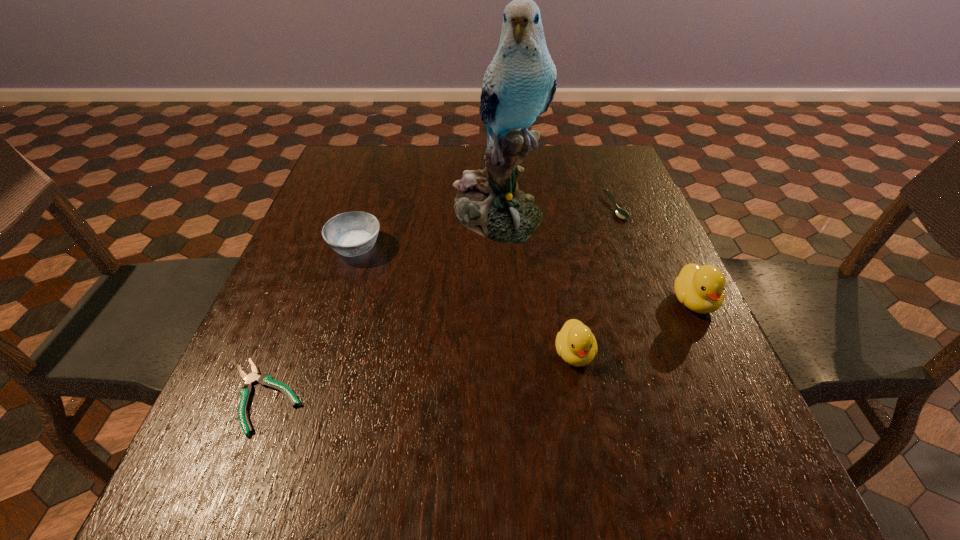
The width and height of the screenshot is (960, 540). I want to click on empty location between the fourth tallest object and the shortest object, so click(310, 322).

Where is `vacant space in between the pliers and the left duckling`? This screenshot has height=540, width=960. vacant space in between the pliers and the left duckling is located at coordinates (420, 375).

Locate an element on the screen. The width and height of the screenshot is (960, 540). free point between the pliers and the fifth shortest object is located at coordinates (479, 349).

You are a GUI agent. You are given a task and a screenshot of the screen. Output one action in this format:
    pyautogui.click(x=<x>, y=<y>)
    Task: Click on the vacant area that lies between the parakeet and the nearer duckling
    The height and width of the screenshot is (540, 960).
    Given the screenshot: What is the action you would take?
    pyautogui.click(x=536, y=284)

You are a GUI agent. You are given a task and a screenshot of the screen. Output one action in this format:
    pyautogui.click(x=<x>, y=<y>)
    Task: Click on the empty space between the taller duckling and the left duckling
    
    Given the screenshot: What is the action you would take?
    pyautogui.click(x=634, y=327)

Identify the location of free space between the nearer duckling and the second object from right to left. (595, 280).

Locate an element on the screen. vacant area that lies between the fourth shortest object and the soupspoon is located at coordinates (595, 280).

The image size is (960, 540). What are the coordinates of `blank region between the second tallest object and the tallest object` in the screenshot? It's located at (595, 258).

The height and width of the screenshot is (540, 960). What are the coordinates of `free space between the third nearest object and the second object from right to left` in the screenshot? It's located at (655, 254).

Select which object appears as the fourth closest to the left duckling. Please provide its 2D coordinates. Your answer should be formatted as a tuple, i.e. [(x, y)], where the tuple contains the x and y coordinates of a point satisfying the conditions above.

[(354, 233)]